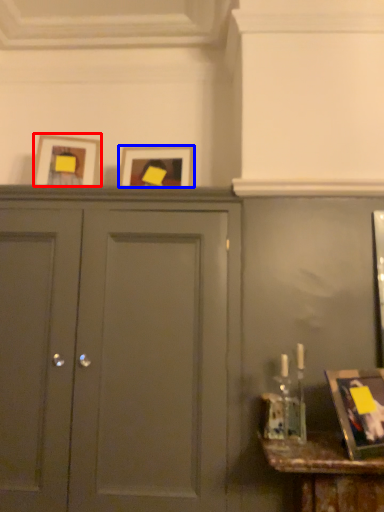
Question: Among these objects, which one is nearest to the camera, picture frame (highlighted by a red box) or picture frame (highlighted by a blue box)?

Choices:
 (A) picture frame
 (B) picture frame

Answer: (A)